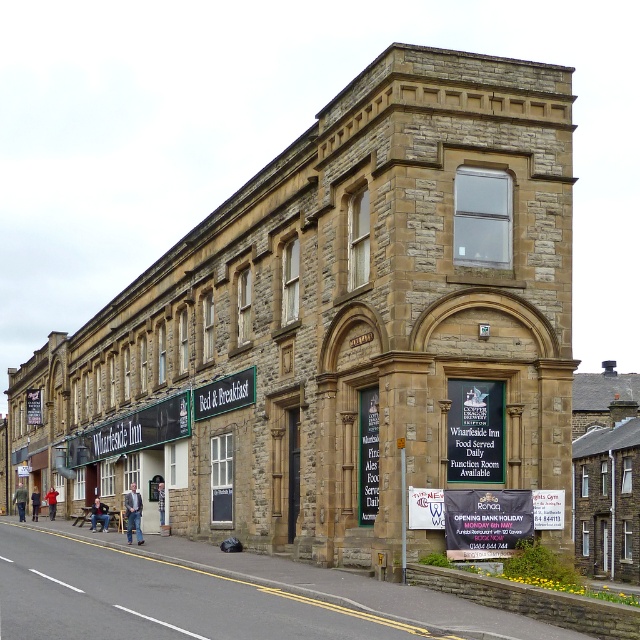
You are a guest at the Wharfside Inn and want to read the information on both the white plastic banner at lower center and the greensignboard at center. Which sign should you stand closer to in order to read both clearly?

The white plastic banner at lower center is shorter than the greensignboard at center, so you should stand closer to the white plastic banner at lower center to read both signs clearly.

You are a guest approaching the Wharfside Inn and notice two signs. The first is the white plastic banner at lower center and the second is the greensignboard at center. Which of these signs is wider?

The white plastic banner at lower center is narrower than the greensignboard at center, so the greensignboard at center is wider.